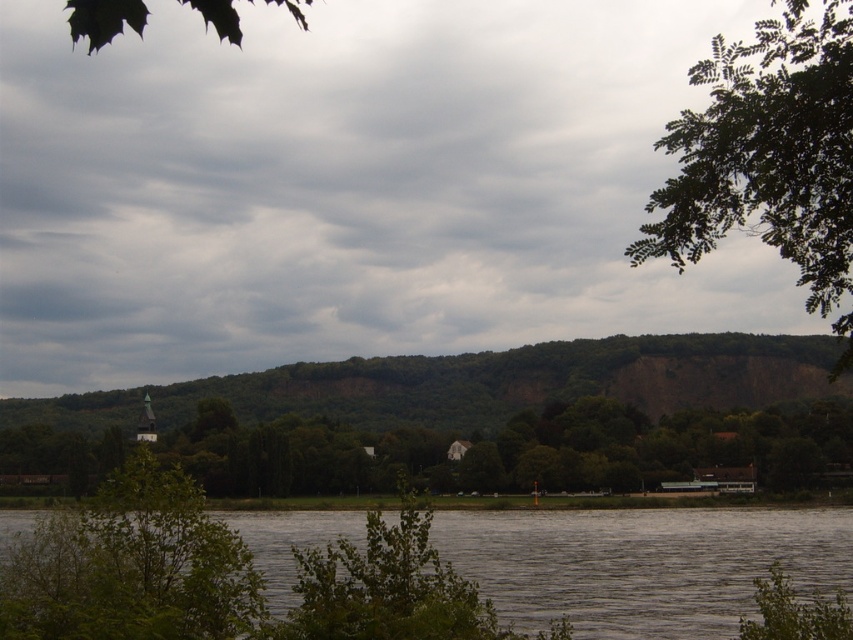
Question: Does gray water at lower center appear under green matte leaf at upper left?

Choices:
 (A) no
 (B) yes

Answer: (B)

Question: Which of the following is the farthest from the observer?

Choices:
 (A) gray water at lower center
 (B) green leafy tree at upper right
 (C) green leafy hill at center
 (D) green matte leaf at upper left

Answer: (C)

Question: Which object appears closest to the camera in this image?

Choices:
 (A) gray water at lower center
 (B) green leafy hill at center

Answer: (A)

Question: Can you confirm if gray water at lower center is smaller than green matte leaf at upper left?

Choices:
 (A) yes
 (B) no

Answer: (A)

Question: Can you confirm if gray water at lower center is positioned below green matte leaf at upper left?

Choices:
 (A) no
 (B) yes

Answer: (B)

Question: Which object appears closest to the camera in this image?

Choices:
 (A) gray water at lower center
 (B) green leafy hill at center
 (C) green leafy tree at upper right

Answer: (C)